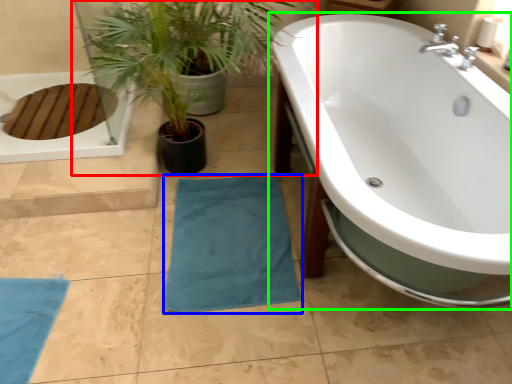
Question: Which object is positioned closest to houseplant (highlighted by a red box)? Select from beach towel (highlighted by a blue box) and bathtub (highlighted by a green box).

Choices:
 (A) beach towel
 (B) bathtub

Answer: (B)